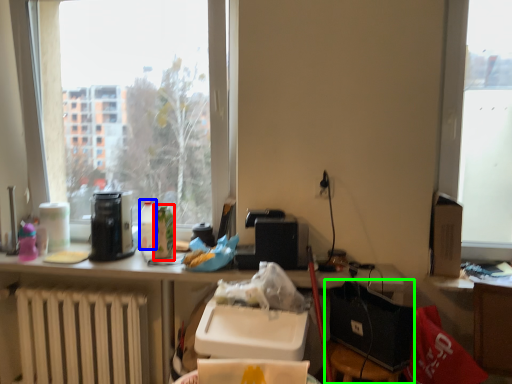
Question: Which is farther away from bottle (highlighted by a red box)? bottle (highlighted by a blue box) or chair (highlighted by a green box)?

Choices:
 (A) bottle
 (B) chair

Answer: (B)